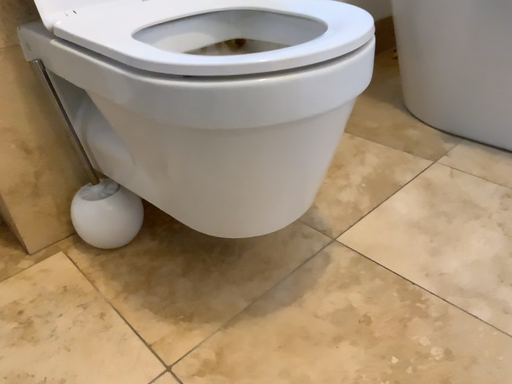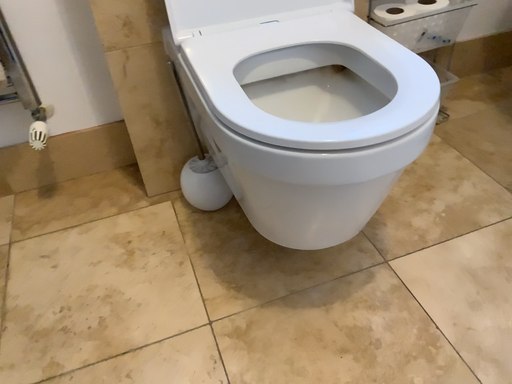
Question: Which way did the camera rotate in the video?

Choices:
 (A) rotated left
 (B) rotated right

Answer: (A)